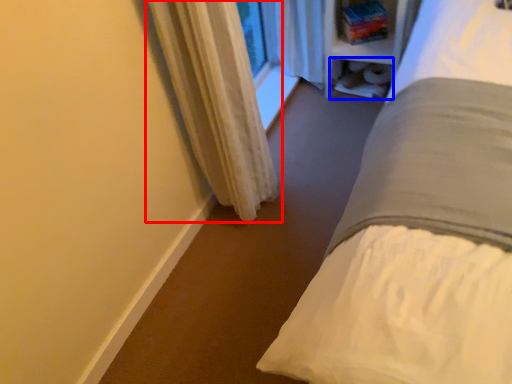
Question: Which point is closer to the camera, curtain (highlighted by a red box) or shelf (highlighted by a blue box)?

Choices:
 (A) curtain
 (B) shelf

Answer: (A)